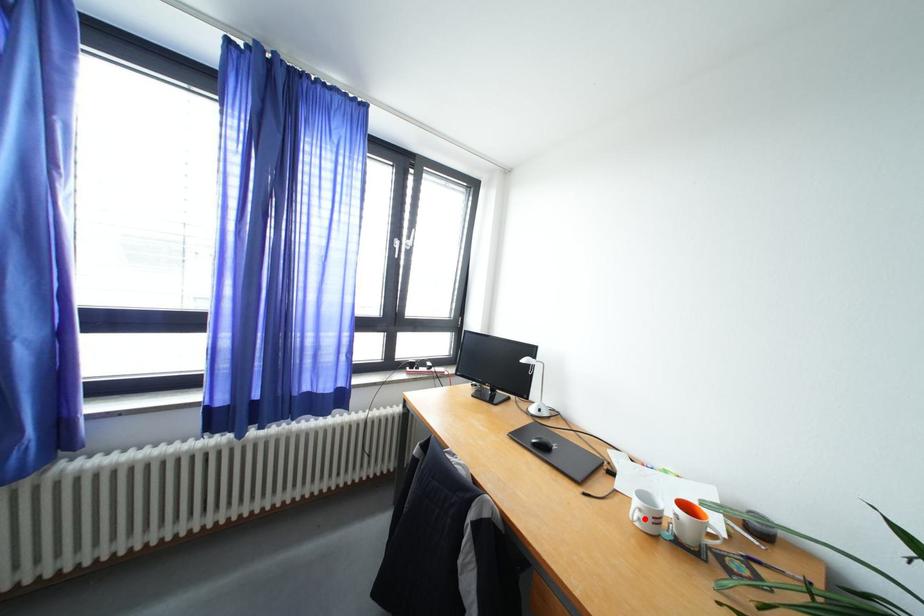
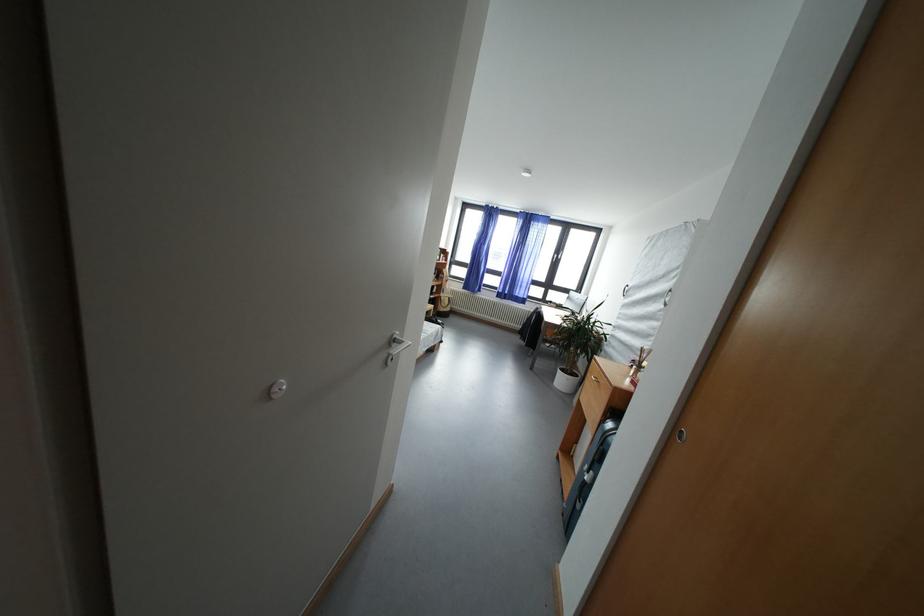
Question: I am providing you with two images of the same scene from different viewpoints. A red point is marked on the first image. At the location where the point appears in image 1, is it still visible in image 2?

Choices:
 (A) Yes
 (B) No

Answer: (B)